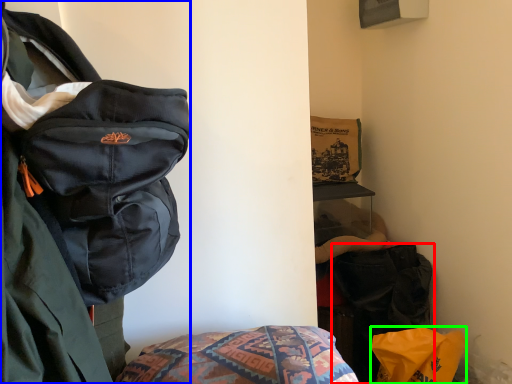
Question: Based on their relative distances, which object is farther from luggage and bags (highlighted by a red box)? Choose from backpack (highlighted by a blue box) and material (highlighted by a green box).

Choices:
 (A) backpack
 (B) material

Answer: (A)